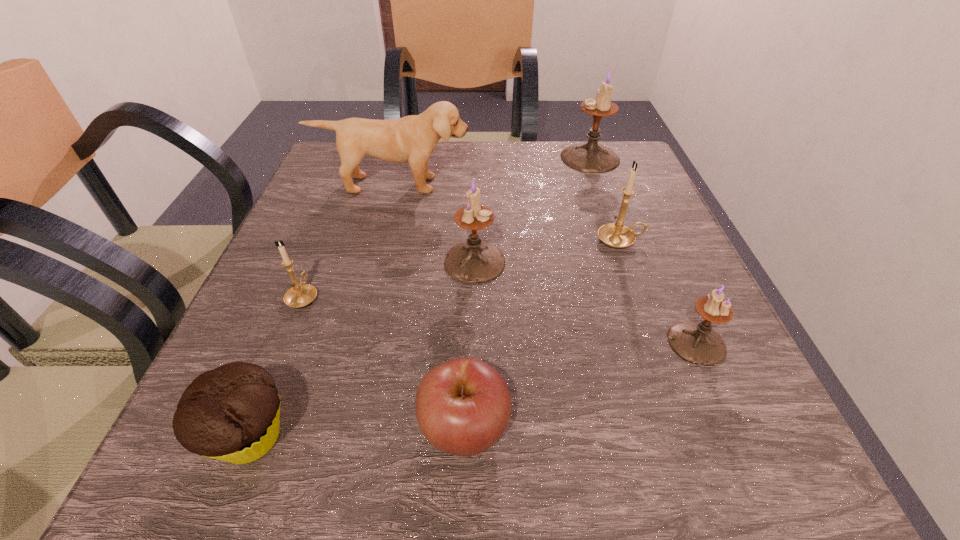
Where is `the tallest candle holder`? the tallest candle holder is located at coordinates (590, 157).

Where is `the farthest purple candle holder`? the farthest purple candle holder is located at coordinates (590, 157).

Where is `the second farthest object`? This screenshot has width=960, height=540. the second farthest object is located at coordinates (413, 138).

Identify the location of beige puppy. The height and width of the screenshot is (540, 960). (413, 138).

Locate an element on the screen. This screenshot has width=960, height=540. the second biggest purple candle holder is located at coordinates (474, 261).

Locate an element on the screen. The height and width of the screenshot is (540, 960). the leftmost purple candle holder is located at coordinates (474, 261).

Locate an element on the screen. the bigger gold candle holder is located at coordinates (617, 235).

You are a GUI agent. You are given a task and a screenshot of the screen. Output one action in this format:
    pyautogui.click(x=<x>, y=<y>)
    Task: Click on the farther gold candle holder
    This screenshot has height=540, width=960.
    Given the screenshot: What is the action you would take?
    pyautogui.click(x=617, y=235)

The image size is (960, 540). Identify the location of the nearer gold candle holder. (299, 295).

The height and width of the screenshot is (540, 960). I want to click on the left gold candle holder, so click(x=299, y=295).